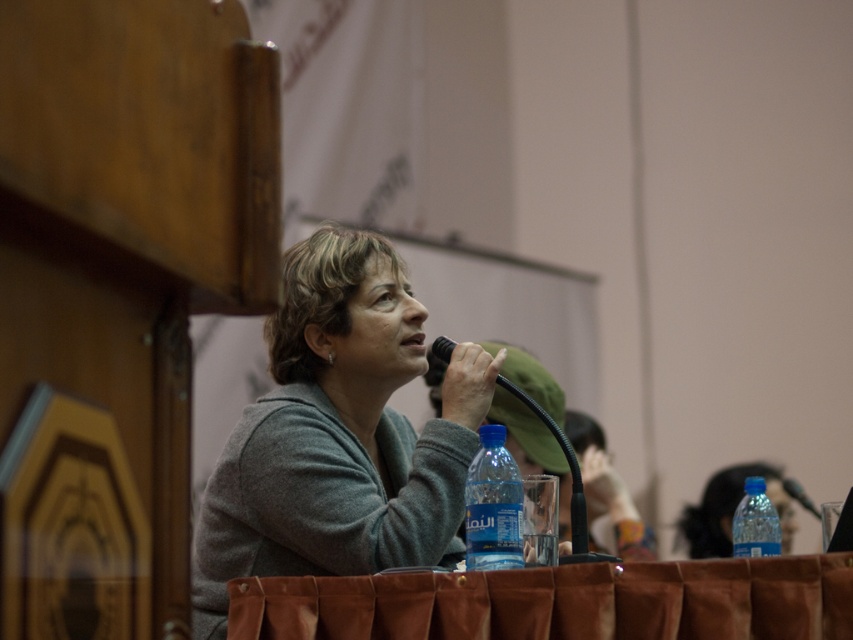
Question: From the image, what is the correct spatial relationship of blue plastic bottle at lower center in relation to transparent plastic bottle at lower right?

Choices:
 (A) below
 (B) above

Answer: (B)

Question: Does blue plastic bottle at lower right appear under black plastic microphone at center?

Choices:
 (A) no
 (B) yes

Answer: (A)

Question: Which point is farther to the camera?

Choices:
 (A) (701, 497)
 (B) (363, 336)

Answer: (A)

Question: Which object is farther from the camera taking this photo?

Choices:
 (A) black plastic microphone at center
 (B) blue plastic bottle at lower right
 (C) transparent plastic bottle at lower right
 (D) gray matte sweater at center

Answer: (A)

Question: Can you confirm if transparent plastic bottle at lower right is positioned below blue plastic bottle at lower right?

Choices:
 (A) no
 (B) yes

Answer: (B)

Question: Which object is farther from the camera taking this photo?

Choices:
 (A) blue plastic bottle at lower right
 (B) transparent plastic bottle at lower right
 (C) black plastic microphone at center
 (D) gray matte sweater at center

Answer: (C)